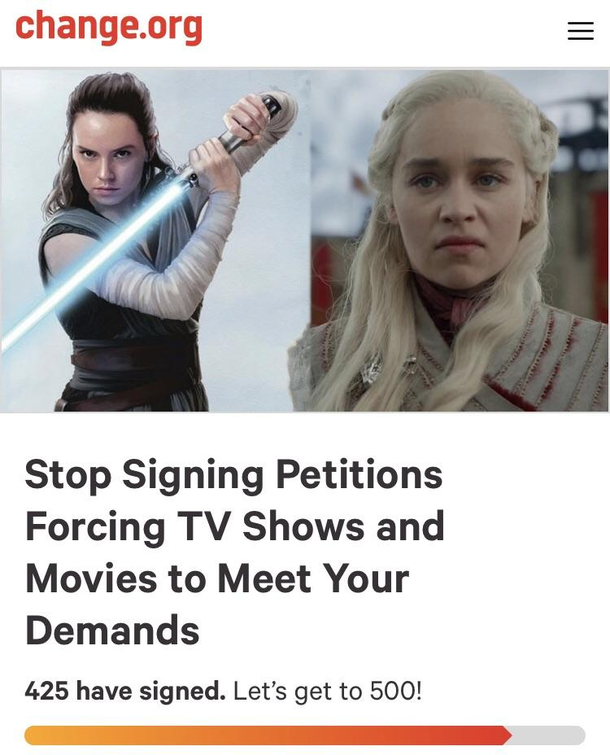
This screenshot has width=610, height=755. I want to click on tv, so click(196, 528).